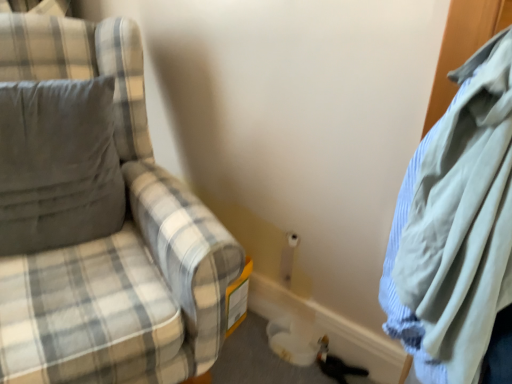
Question: Is plaid fabric chair at left closer to camera compared to light blue cotton shirt at right?

Choices:
 (A) yes
 (B) no

Answer: (B)

Question: Is plaid fabric chair at left far from light blue cotton shirt at right?

Choices:
 (A) yes
 (B) no

Answer: (B)

Question: Can you confirm if plaid fabric chair at left is taller than light blue cotton shirt at right?

Choices:
 (A) yes
 (B) no

Answer: (A)

Question: Does plaid fabric chair at left have a lesser height compared to light blue cotton shirt at right?

Choices:
 (A) yes
 (B) no

Answer: (B)

Question: Is plaid fabric chair at left placed right next to light blue cotton shirt at right?

Choices:
 (A) no
 (B) yes

Answer: (A)

Question: Could you tell me if plaid fabric chair at left is facing light blue cotton shirt at right?

Choices:
 (A) no
 (B) yes

Answer: (A)

Question: From the image's perspective, is plaid fabric chair at left over gray fabric pillow at left?

Choices:
 (A) yes
 (B) no

Answer: (B)

Question: Considering the relative sizes of plaid fabric chair at left and gray fabric pillow at left in the image provided, is plaid fabric chair at left wider than gray fabric pillow at left?

Choices:
 (A) yes
 (B) no

Answer: (A)

Question: Can you confirm if plaid fabric chair at left is positioned to the left of gray fabric pillow at left?

Choices:
 (A) no
 (B) yes

Answer: (A)

Question: Is plaid fabric chair at left aimed at gray fabric pillow at left?

Choices:
 (A) no
 (B) yes

Answer: (B)

Question: Can you confirm if plaid fabric chair at left is taller than gray fabric pillow at left?

Choices:
 (A) yes
 (B) no

Answer: (A)

Question: Can you confirm if plaid fabric chair at left is positioned to the right of gray fabric pillow at left?

Choices:
 (A) yes
 (B) no

Answer: (A)

Question: Does light blue cotton shirt at right lie behind plaid fabric chair at left?

Choices:
 (A) yes
 (B) no

Answer: (B)